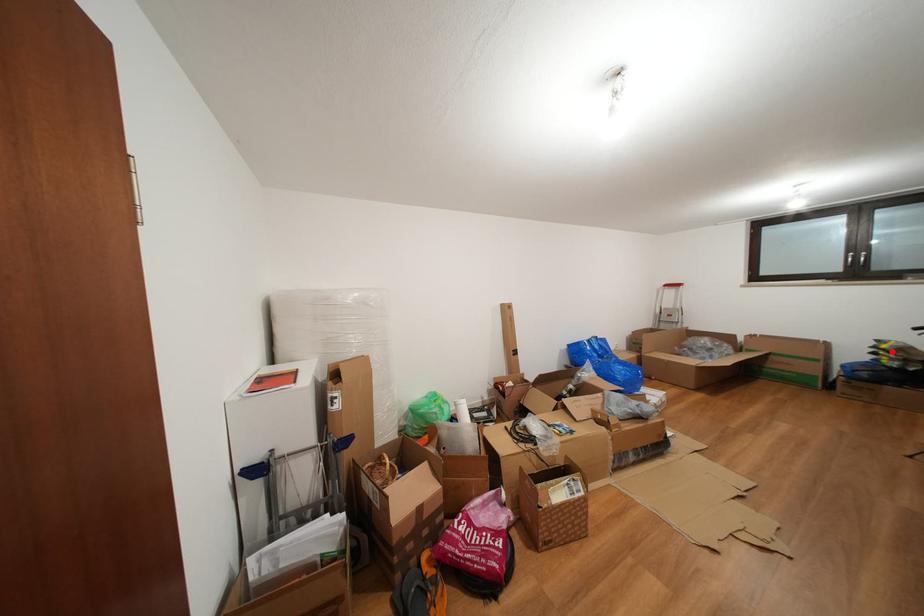
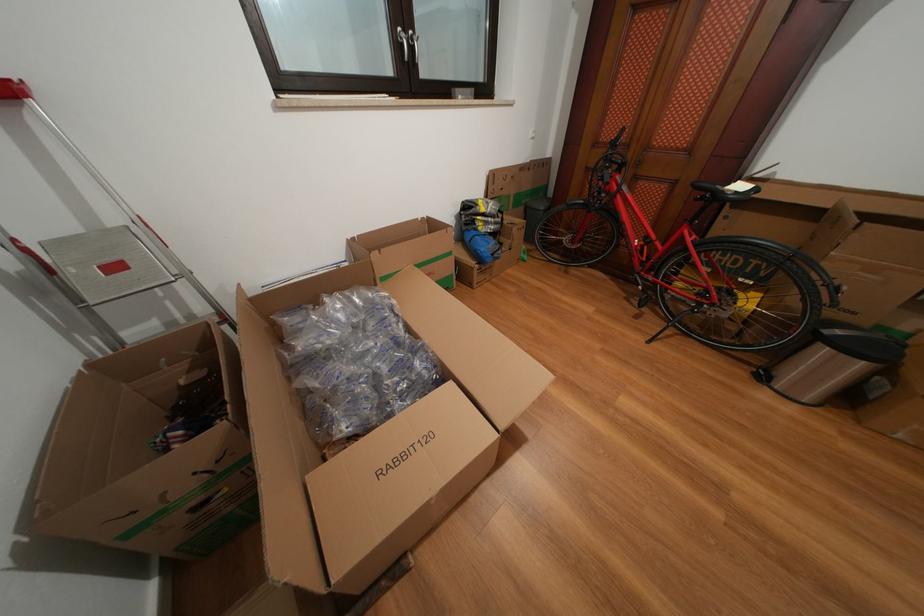
Question: I am providing you with two images of the same scene from different viewpoints. In image1, a red point is highlighted. Considering the same 3D point in image2, which of the following is correct?

Choices:
 (A) It is closer
 (B) It is farther

Answer: (A)